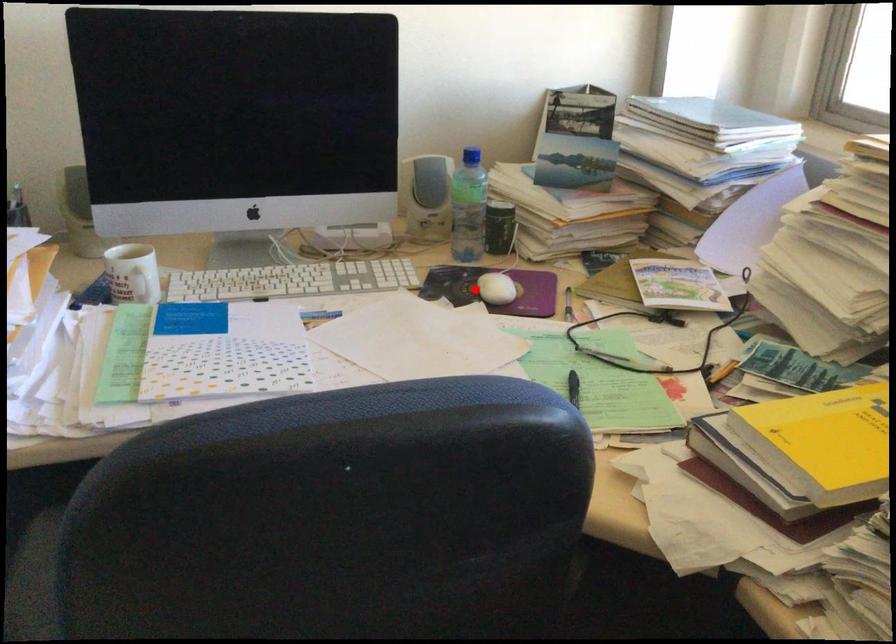
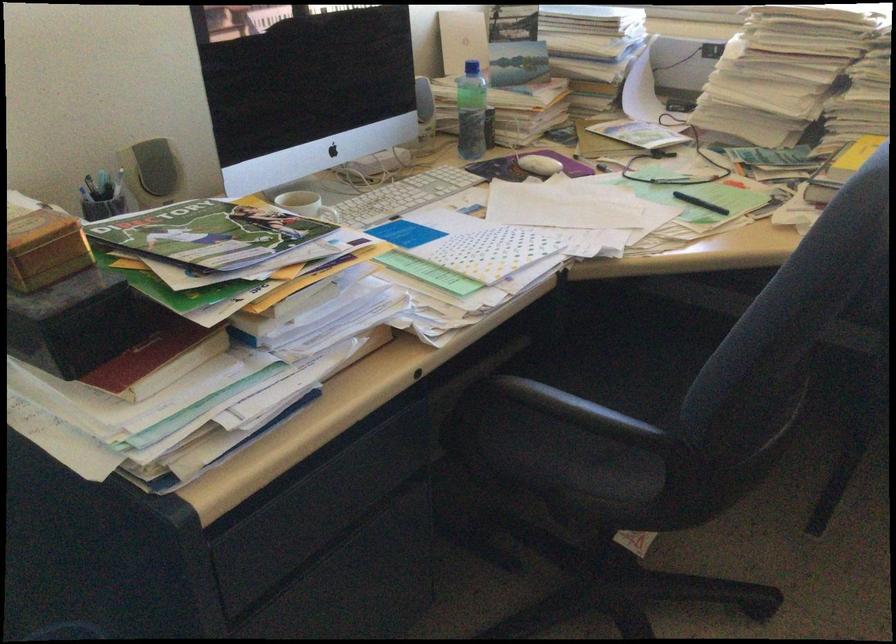
The point at the highlighted location is marked in the first image. Where is the corresponding point in the second image?

(538, 165)